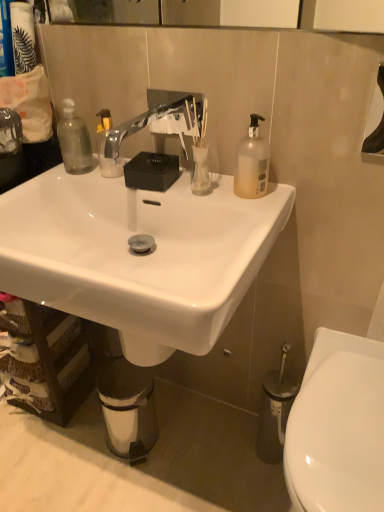
Question: Would you say brown woven basket at lower left is outside translucent plastic bottle at upper right?

Choices:
 (A) yes
 (B) no

Answer: (A)

Question: Considering the relative sizes of brown woven basket at lower left and translucent plastic bottle at upper right in the image provided, is brown woven basket at lower left shorter than translucent plastic bottle at upper right?

Choices:
 (A) no
 (B) yes

Answer: (A)

Question: Could translucent plastic bottle at upper right be considered to be inside brown woven basket at lower left?

Choices:
 (A) no
 (B) yes

Answer: (A)

Question: Is brown woven basket at lower left far away from translucent plastic bottle at upper right?

Choices:
 (A) no
 (B) yes

Answer: (A)

Question: Considering the relative positions of brown woven basket at lower left and translucent plastic bottle at upper right in the image provided, is brown woven basket at lower left behind translucent plastic bottle at upper right?

Choices:
 (A) yes
 (B) no

Answer: (A)

Question: From a real-world perspective, relative to white glossy toilet at lower right, is white glossy sink at center vertically above or below?

Choices:
 (A) below
 (B) above

Answer: (B)

Question: Considering the positions of white glossy sink at center and white glossy toilet at lower right in the image, is white glossy sink at center taller or shorter than white glossy toilet at lower right?

Choices:
 (A) tall
 (B) short

Answer: (A)

Question: Considering their positions, is white glossy sink at center located in front of or behind white glossy toilet at lower right?

Choices:
 (A) behind
 (B) front

Answer: (B)

Question: Considering the positions of white glossy sink at center and white glossy toilet at lower right in the image, is white glossy sink at center wider or thinner than white glossy toilet at lower right?

Choices:
 (A) wide
 (B) thin

Answer: (B)

Question: From a real-world perspective, relative to matte black canister at upper left, is transparent glass vase at center vertically above or below?

Choices:
 (A) below
 (B) above

Answer: (A)

Question: Is transparent glass vase at center in front of or behind matte black canister at upper left in the image?

Choices:
 (A) front
 (B) behind

Answer: (A)

Question: Is point tap(205, 156) positioned closer to the camera than point tap(34, 65)?

Choices:
 (A) farther
 (B) closer

Answer: (B)

Question: From the image's perspective, is transparent glass vase at center positioned above or below matte black canister at upper left?

Choices:
 (A) below
 (B) above

Answer: (A)

Question: Looking at their shapes, would you say white glossy toilet at lower right is wider or thinner than metallic silver trash can at lower center?

Choices:
 (A) thin
 (B) wide

Answer: (B)

Question: In terms of size, does white glossy toilet at lower right appear bigger or smaller than metallic silver trash can at lower center?

Choices:
 (A) small
 (B) big

Answer: (B)